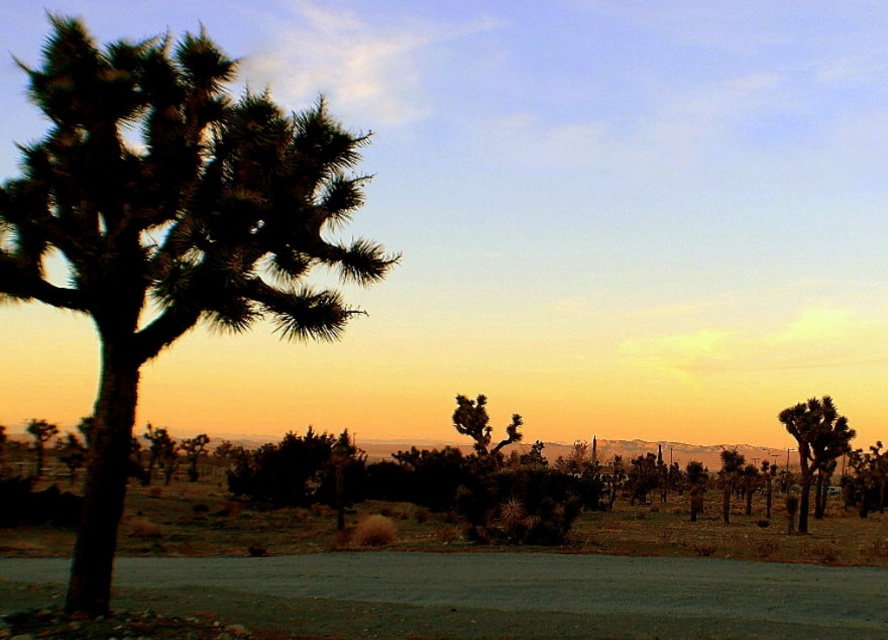
Between green spiky palm tree at right and green spiky tree at center, which one is positioned lower?

green spiky palm tree at right is below.

The height and width of the screenshot is (640, 888). What do you see at coordinates (815, 444) in the screenshot? I see `green spiky palm tree at right` at bounding box center [815, 444].

Locate an element on the screen. The width and height of the screenshot is (888, 640). green spiky palm tree at right is located at coordinates (815, 444).

From the picture: Is the position of green spiky palm tree at left less distant than that of green spiky palm tree at right?

Yes, green spiky palm tree at left is in front of green spiky palm tree at right.

Consider the image. Does green spiky palm tree at left have a smaller size compared to green spiky palm tree at right?

Yes.

Identify the location of green spiky palm tree at left. The height and width of the screenshot is (640, 888). (168, 227).

Which is more to the right, green spiky palm tree at left or green spiky tree at center?

Positioned to the right is green spiky tree at center.

Where is `green spiky palm tree at left`? green spiky palm tree at left is located at coordinates (168, 227).

The image size is (888, 640). What do you see at coordinates (168, 227) in the screenshot?
I see `green spiky palm tree at left` at bounding box center [168, 227].

Where is `green spiky palm tree at left`? green spiky palm tree at left is located at coordinates (168, 227).